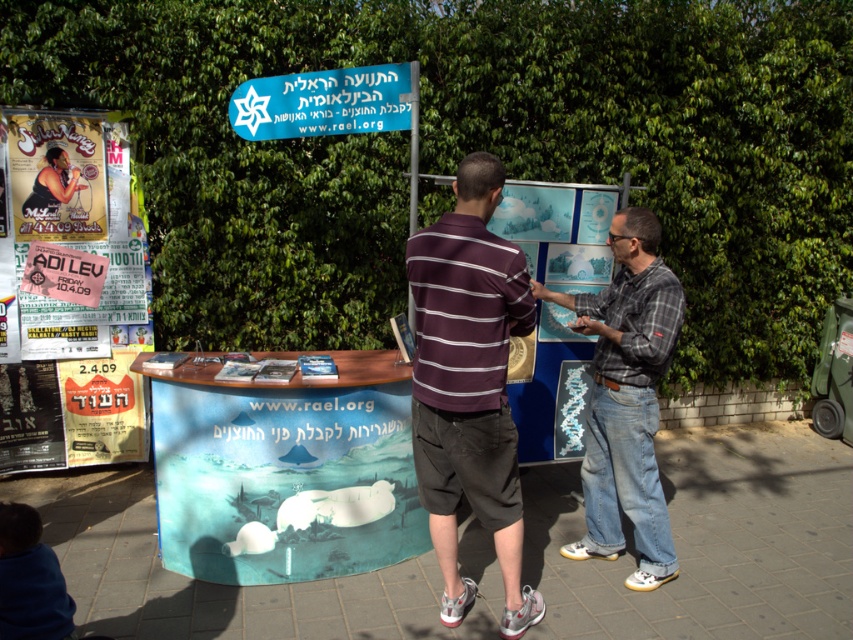
Based on the photo, you are standing at the entrance of the booth and want to approach the person in the plaid shirt at center to ask about the marine conservation efforts. Based on their position relative to you, which direction should you move to reach them?

The plaid shirt at center is located at point 0.623 on the x and 0.735 on the y coordinate, so you should move towards the center of the booth to reach them.

You are at the promotional booth and want to read the text on both the paper posters at left and the blue plastic sign at upper center. Which one can you read more clearly without moving closer?

The paper posters at left can be read more clearly without moving closer because they are closer to you than the blue plastic sign at upper center.